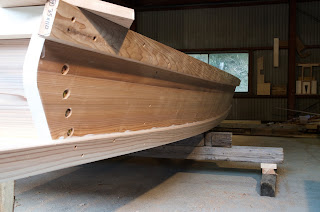
The width and height of the screenshot is (320, 212). I want to click on horizontal boards under item, so click(x=258, y=155), click(x=182, y=156), click(x=148, y=154).